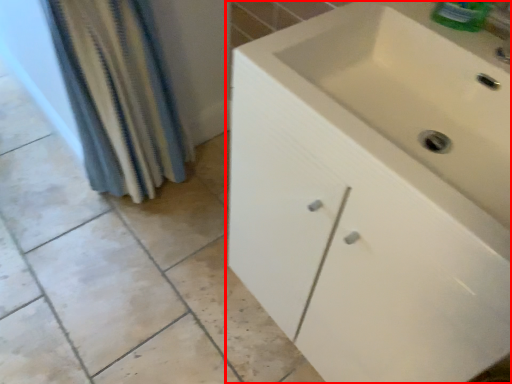
Question: From the image's perspective, what is the correct spatial positioning of bathroom cabinet (annotated by the red box) in reference to shower curtain?

Choices:
 (A) below
 (B) above

Answer: (A)